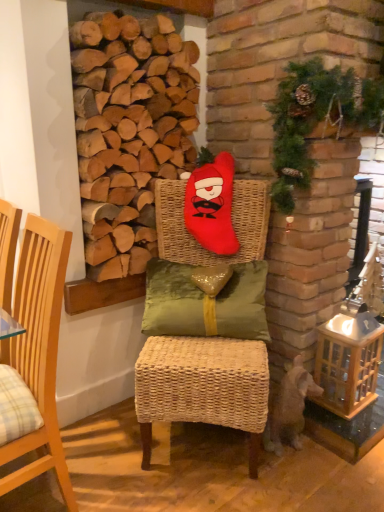
Question: Is matte red plush at center, which is the 1th chair from right to left, at the left side of green textured wreath at upper right?

Choices:
 (A) yes
 (B) no

Answer: (A)

Question: Can you confirm if matte red plush at center, the second chair from the left, is wider than green textured wreath at upper right?

Choices:
 (A) yes
 (B) no

Answer: (A)

Question: Considering the relative positions of matte red plush at center, the second chair from the left, and green textured wreath at upper right in the image provided, is matte red plush at center, the second chair from the left, in front of green textured wreath at upper right?

Choices:
 (A) no
 (B) yes

Answer: (A)

Question: Can you confirm if matte red plush at center, which is the 1th chair from right to left, is bigger than green textured wreath at upper right?

Choices:
 (A) no
 (B) yes

Answer: (B)

Question: Does matte red plush at center, the second chair from the left, have a greater height compared to green textured wreath at upper right?

Choices:
 (A) no
 (B) yes

Answer: (B)

Question: From the image's perspective, is matte red plush at center, the second chair from the left, located beneath green textured wreath at upper right?

Choices:
 (A) yes
 (B) no

Answer: (A)

Question: Considering the relative sizes of matte red plush at center, which is the 1th chair from right to left, and green satin pillow at center in the image provided, is matte red plush at center, which is the 1th chair from right to left, smaller than green satin pillow at center?

Choices:
 (A) no
 (B) yes

Answer: (A)

Question: Does matte red plush at center, the second chair from the left, turn towards green satin pillow at center?

Choices:
 (A) no
 (B) yes

Answer: (B)

Question: Is matte red plush at center, the second chair from the left, not within green satin pillow at center?

Choices:
 (A) yes
 (B) no

Answer: (A)

Question: Is green satin pillow at center inside matte red plush at center, which is the 1th chair from right to left?

Choices:
 (A) yes
 (B) no

Answer: (A)

Question: From the image's perspective, does matte red plush at center, which is the 1th chair from right to left, appear lower than green satin pillow at center?

Choices:
 (A) no
 (B) yes

Answer: (B)

Question: Considering the relative positions of matte red plush at center, which is the 1th chair from right to left, and green satin pillow at center in the image provided, is matte red plush at center, which is the 1th chair from right to left, to the right of green satin pillow at center from the viewer's perspective?

Choices:
 (A) no
 (B) yes

Answer: (B)

Question: Is light wood chair at left, which appears as the 1th chair when viewed from the left, smaller than matte red plush at center, the second chair from the left?

Choices:
 (A) no
 (B) yes

Answer: (B)